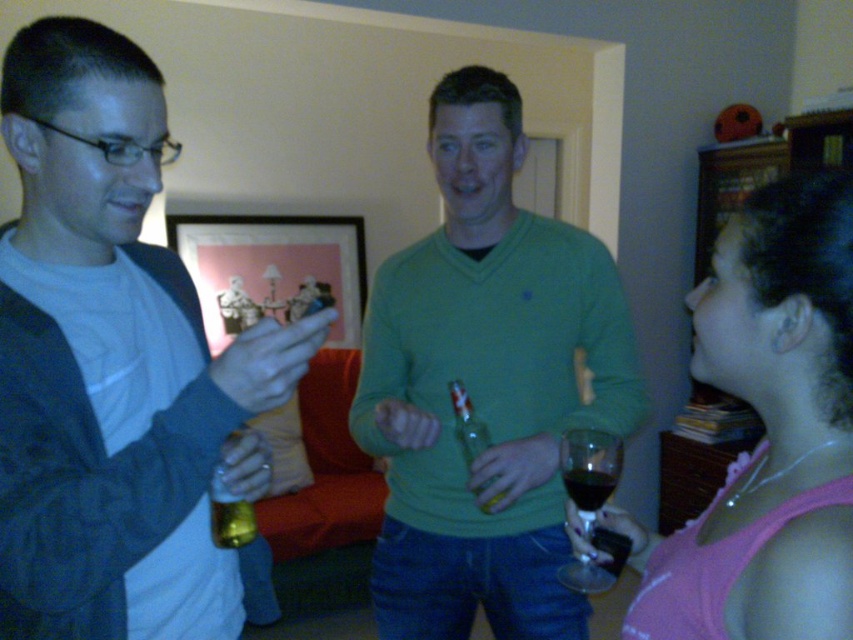
Question: Is the position of translucent glass bottle at center less distant than that of gold metallic can at center?

Choices:
 (A) yes
 (B) no

Answer: (B)

Question: Based on their relative distances, which object is nearer to the matte black jacket at left?

Choices:
 (A) translucent glass bottle at center
 (B) green matte sweater at center
 (C) transparent glass at center

Answer: (B)

Question: Can you confirm if matte black jacket at left is positioned above gold metallic can at center?

Choices:
 (A) no
 (B) yes

Answer: (B)

Question: From the image, what is the correct spatial relationship of matte black jacket at left in relation to dark red glass at center?

Choices:
 (A) left
 (B) right

Answer: (A)

Question: Which of the following is the closest to the observer?

Choices:
 (A) transparent glass at center
 (B) green matte sweater at center

Answer: (A)

Question: Estimate the real-world distances between objects in this image. Which object is farther from the gold metallic can at center?

Choices:
 (A) transparent glass at center
 (B) green matte sweater at center

Answer: (B)